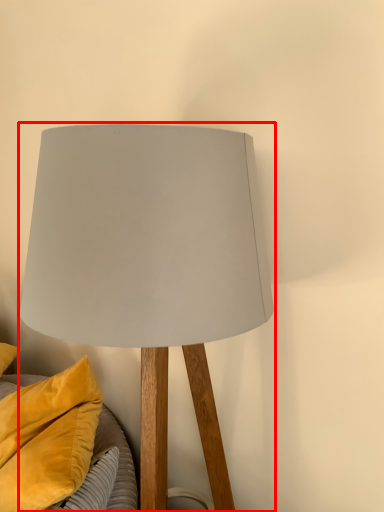
Question: From the image's perspective, considering the relative positions of lamp (annotated by the red box) and pillow in the image provided, where is lamp (annotated by the red box) located with respect to the staircase?

Choices:
 (A) below
 (B) above

Answer: (B)